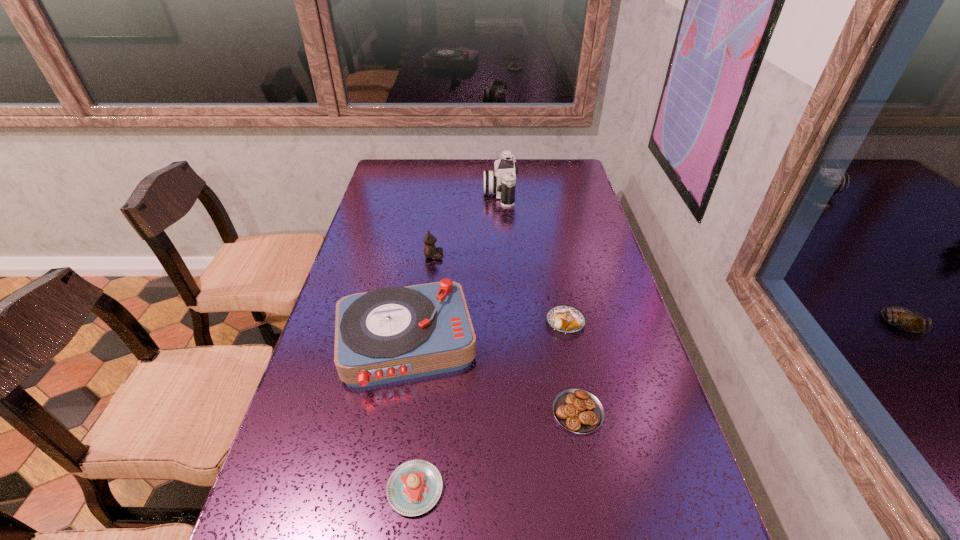
At what (x,y) coordinates should I click in order to perform the action: click on free region that satisfies the following two spatial constraints: 1. on the face of the farthest pastry; 2. on the left side of the fifth nearest object. Please return your answer as a coordinate pair (x, y). Looking at the image, I should click on (425, 322).